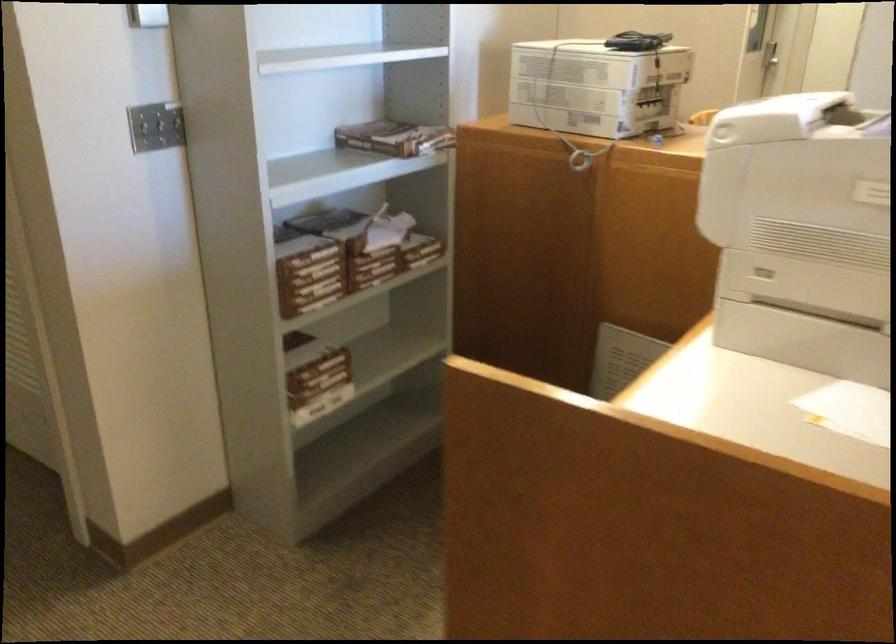
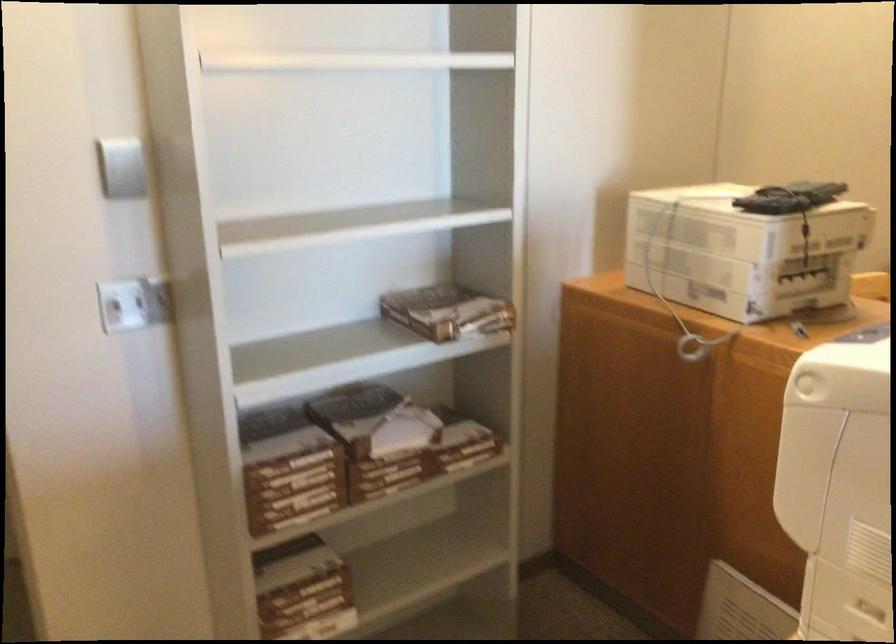
In a continuous first-person perspective shot, in which direction is the camera moving?

The movement direction of the cameraman is right, forward.